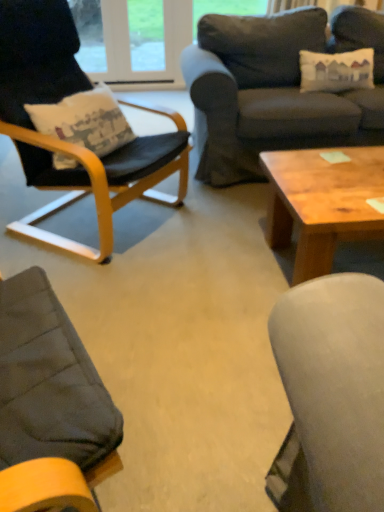
Identify the location of free space in front of black leather chair at left. The width and height of the screenshot is (384, 512). (128, 295).